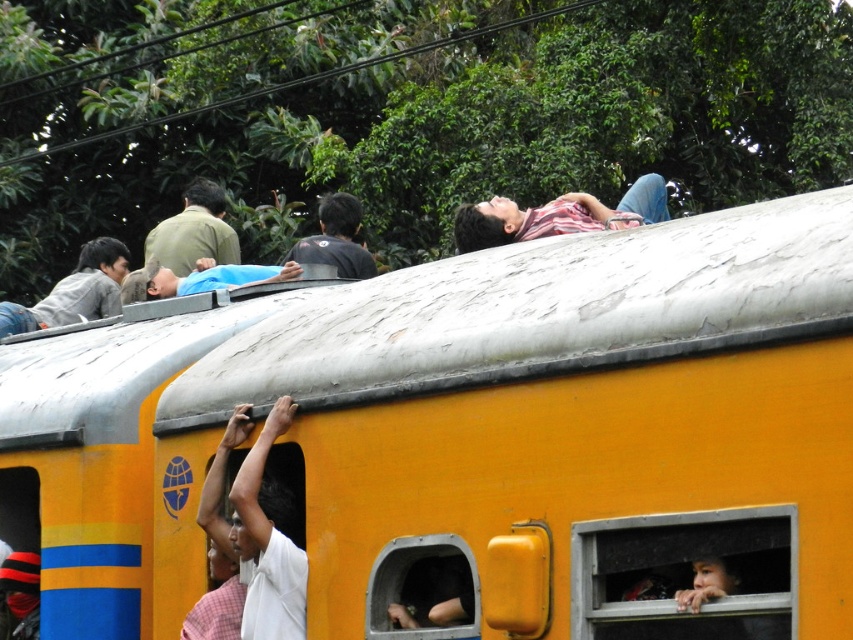
Question: Is yellow matte train car at upper center wider than transparent glass window at lower right?

Choices:
 (A) yes
 (B) no

Answer: (A)

Question: Which point is farther to the camera?

Choices:
 (A) black matte shirt at upper center
 (B) transparent glass window at lower right
 (C) striped fabric shirt at top
 (D) green matte shirt at upper left

Answer: (D)

Question: Estimate the real-world distances between objects in this image. Which object is closer to the green matte shirt at upper left?

Choices:
 (A) metallic gray window at center
 (B) yellow matte train car at upper center
 (C) black matte shirt at upper center
 (D) striped fabric shirt at top

Answer: (C)

Question: Is green matte shirt at upper left closer to the viewer compared to black matte shirt at upper center?

Choices:
 (A) yes
 (B) no

Answer: (B)

Question: Which point appears closest to the camera in this image?

Choices:
 (A) (149, 259)
 (B) (381, 634)
 (C) (82, 604)
 (D) (350, 214)

Answer: (B)

Question: Is the position of green matte shirt at upper left more distant than that of black matte shirt at upper center?

Choices:
 (A) yes
 (B) no

Answer: (A)